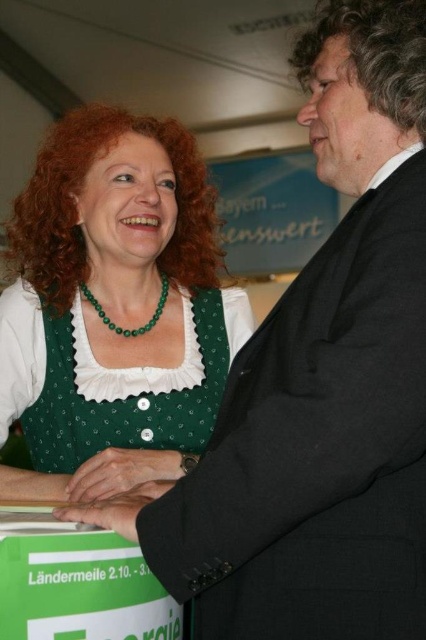
Question: Is green fabric dress at center positioned in front of smooth black hand at center?

Choices:
 (A) yes
 (B) no

Answer: (B)

Question: Is green fabric dress at center to the right of smooth black hand at center from the viewer's perspective?

Choices:
 (A) no
 (B) yes

Answer: (A)

Question: Which object is the closest to the smooth black hand at center?

Choices:
 (A) green cardboard box at lower left
 (B) green beaded necklace at center
 (C) green fabric dress at center

Answer: (A)

Question: Which is farther from the green fabric dress at center?

Choices:
 (A) green cardboard box at lower left
 (B) green fabric hand at center
 (C) green beaded necklace at center

Answer: (A)

Question: Which object is farther from the camera taking this photo?

Choices:
 (A) green beaded necklace at center
 (B) green cardboard box at lower left

Answer: (A)

Question: Is green fabric hand at center wider than smooth black hand at center?

Choices:
 (A) no
 (B) yes

Answer: (B)